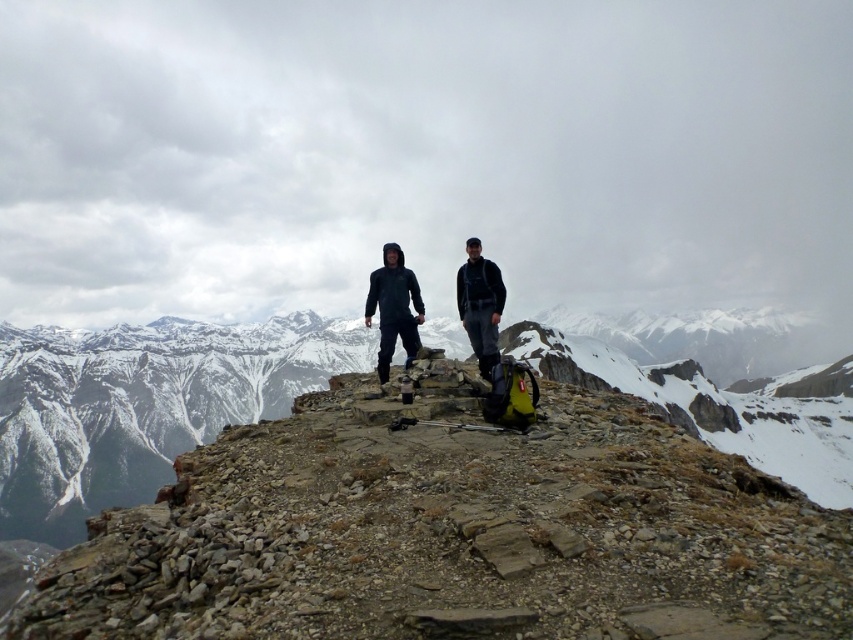
You are planning to take a photo of the two hikers wearing the matte black jacket at center and the dark gray hooded jacket at center. Which jacket is positioned higher in the image?

The matte black jacket at center is located above the dark gray hooded jacket at center, so it is positioned higher in the image.

You are a hiker trying to locate a specific spot on the mountain ridge. The coordinates you have are point (393, 307). Which object in the scene is exactly at that location?

The matte black jacket at center is located at point (393, 307).